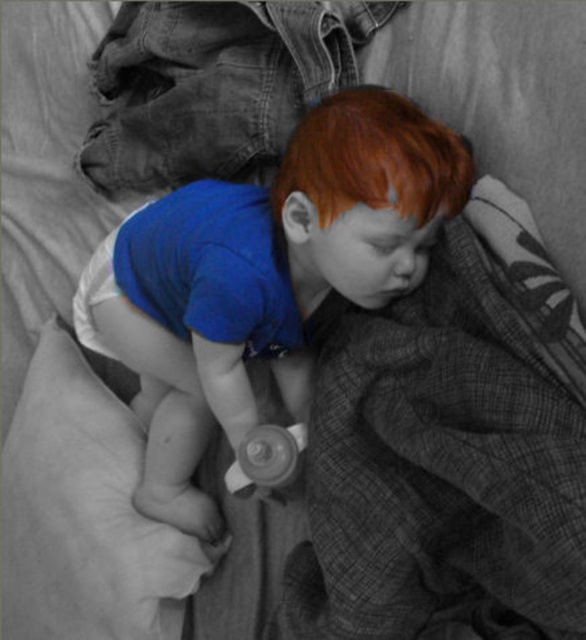
Question: Observing the image, what is the correct spatial positioning of blue cotton shirt at center in reference to rubberized white pacifier at center?

Choices:
 (A) right
 (B) left

Answer: (B)

Question: Among these objects, which one is nearest to the camera?

Choices:
 (A) rubberized white pacifier at center
 (B) blue cotton shirt at center

Answer: (B)

Question: Is blue cotton shirt at center below rubberized white pacifier at center?

Choices:
 (A) no
 (B) yes

Answer: (A)

Question: Does blue cotton shirt at center appear on the left side of rubberized white pacifier at center?

Choices:
 (A) no
 (B) yes

Answer: (B)

Question: Among these points, which one is farthest from the camera?

Choices:
 (A) coord(291,445)
 (B) coord(305,248)

Answer: (A)